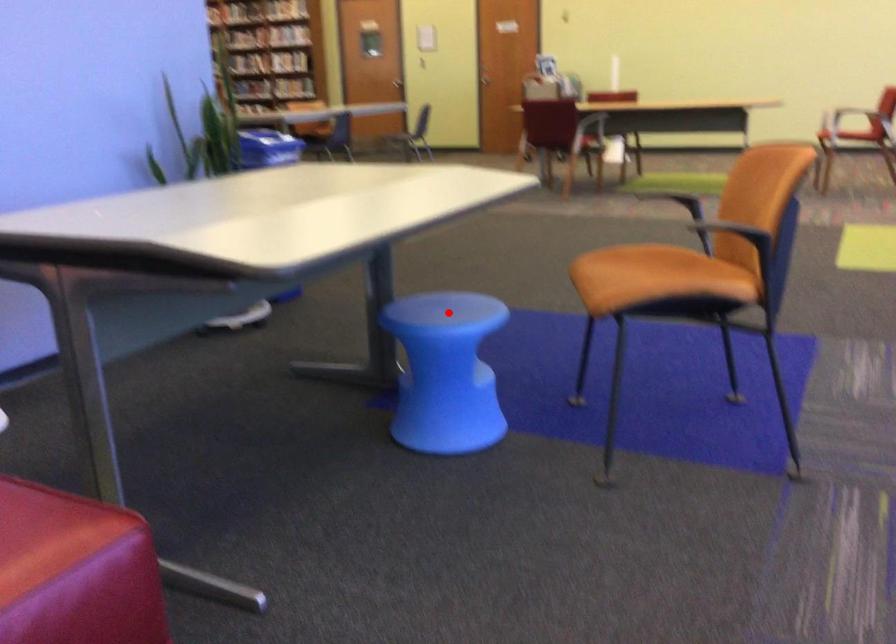
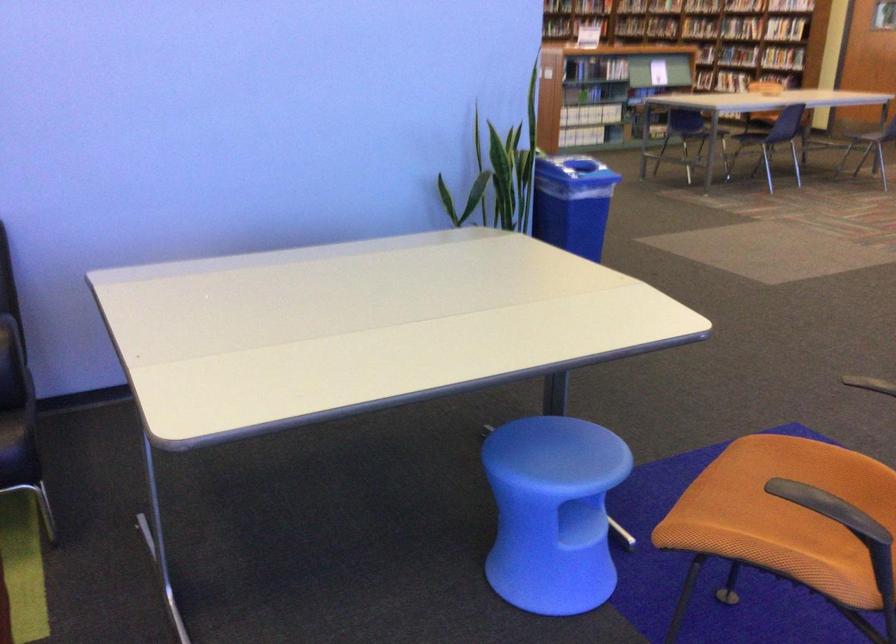
Question: I am providing you with two images of the same scene from different viewpoints. Given a red point in image1, look at the same physical point in image2. Is it:

Choices:
 (A) Closer to the viewpoint
 (B) Farther from the viewpoint

Answer: (A)